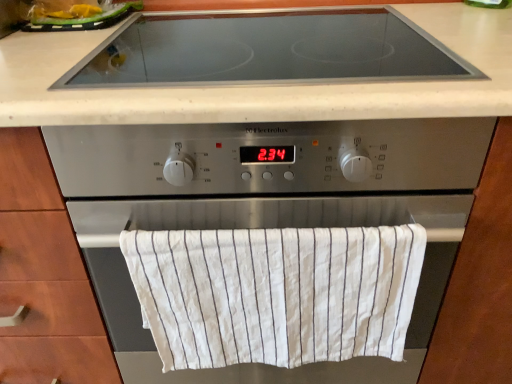
Question: Considering the relative positions of yellow plastic bag at upper left and satin silver oven at center in the image provided, is yellow plastic bag at upper left behind satin silver oven at center?

Choices:
 (A) yes
 (B) no

Answer: (A)

Question: From the image's perspective, does yellow plastic bag at upper left appear higher than satin silver oven at center?

Choices:
 (A) yes
 (B) no

Answer: (A)

Question: From a real-world perspective, is yellow plastic bag at upper left on top of satin silver oven at center?

Choices:
 (A) yes
 (B) no

Answer: (A)

Question: Can you confirm if yellow plastic bag at upper left is wider than satin silver oven at center?

Choices:
 (A) no
 (B) yes

Answer: (A)

Question: Does yellow plastic bag at upper left have a smaller size compared to satin silver oven at center?

Choices:
 (A) yes
 (B) no

Answer: (A)

Question: Is point (222, 91) closer or farther from the camera than point (449, 256)?

Choices:
 (A) closer
 (B) farther

Answer: (A)

Question: Relative to satin silver oven at center, is black glass cooktop at upper center in front or behind?

Choices:
 (A) behind
 (B) front

Answer: (A)

Question: Is black glass cooktop at upper center situated inside satin silver oven at center or outside?

Choices:
 (A) inside
 (B) outside

Answer: (B)

Question: From the image's perspective, is black glass cooktop at upper center located above or below satin silver oven at center?

Choices:
 (A) above
 (B) below

Answer: (A)

Question: Looking at their shapes, would you say satin silver oven at center is wider or thinner than yellow plastic bag at upper left?

Choices:
 (A) thin
 (B) wide

Answer: (B)

Question: Based on their sizes in the image, would you say satin silver oven at center is bigger or smaller than yellow plastic bag at upper left?

Choices:
 (A) big
 (B) small

Answer: (A)

Question: From a real-world perspective, is satin silver oven at center above or below yellow plastic bag at upper left?

Choices:
 (A) above
 (B) below

Answer: (B)

Question: Is satin silver oven at center inside or outside of yellow plastic bag at upper left?

Choices:
 (A) inside
 (B) outside

Answer: (B)

Question: From the image's perspective, is white striped cloth at center positioned above or below satin silver oven at center?

Choices:
 (A) above
 (B) below

Answer: (B)

Question: Is white striped cloth at center inside the boundaries of satin silver oven at center, or outside?

Choices:
 (A) inside
 (B) outside

Answer: (A)